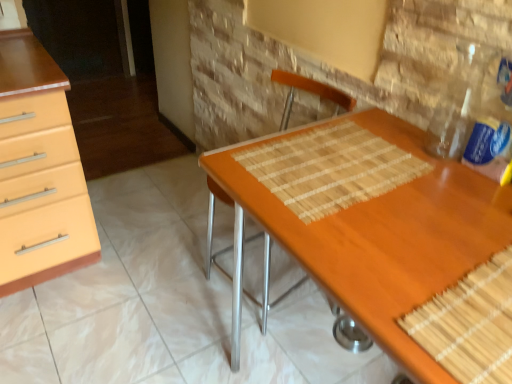
Question: From the image's perspective, is bamboo placemat at center positioned above or below wooden desk at center?

Choices:
 (A) above
 (B) below

Answer: (A)

Question: Is bamboo placemat at center taller or shorter than wooden desk at center?

Choices:
 (A) tall
 (B) short

Answer: (B)

Question: Considering the real-world distances, which object is closest to the orange woven fabric chair at center?

Choices:
 (A) wooden desk at center
 (B) clear plastic bottle at upper right
 (C) bamboo placemat at center

Answer: (C)

Question: Which object is positioned closest to the wooden desk at center?

Choices:
 (A) clear plastic bottle at upper right
 (B) orange woven fabric chair at center
 (C) bamboo placemat at center

Answer: (C)